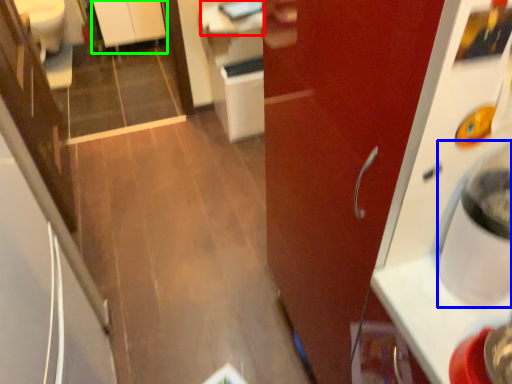
Question: Which object is the farthest from counter top (highlighted by a red box)? Choose among these: water cooler (highlighted by a blue box) or cabinetry (highlighted by a green box).

Choices:
 (A) water cooler
 (B) cabinetry

Answer: (A)